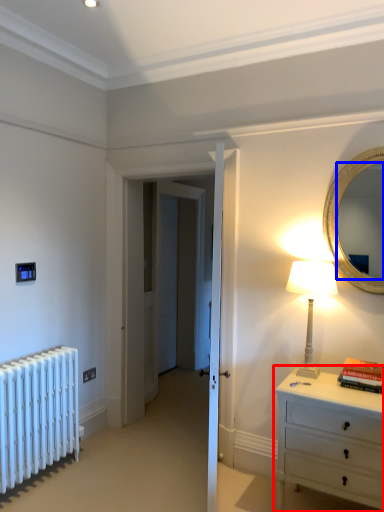
Question: Which point is further to the camera, chest of drawers (highlighted by a red box) or mirror (highlighted by a blue box)?

Choices:
 (A) chest of drawers
 (B) mirror

Answer: (B)